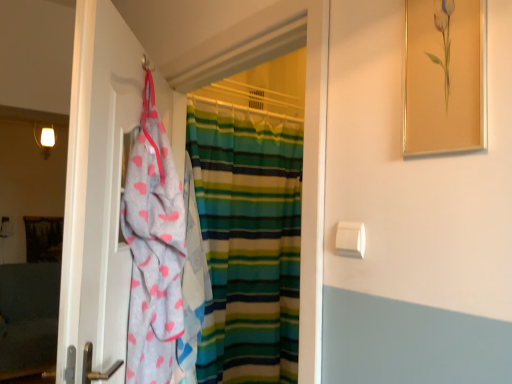
Find the location of a particular element. white plastic towel bar at center right is located at coordinates (350, 239).

What is the approximate height of white plastic towel bar at center right?

It is 3.22 inches.

What do you see at coordinates (97, 186) in the screenshot? This screenshot has height=384, width=512. I see `gray fabric towel at left` at bounding box center [97, 186].

In order to face striped fabric curtain at center, should I rotate leftwards or rightwards?

To face it directly, rotate left by 6.094 degrees.

The image size is (512, 384). What do you see at coordinates (248, 242) in the screenshot?
I see `striped fabric curtain at center` at bounding box center [248, 242].

Image resolution: width=512 pixels, height=384 pixels. I want to click on white plastic towel bar at center right, so click(350, 239).

Is gray fabric towel at left bigger or smaller than gold-framed painting at upper right?

gray fabric towel at left is bigger than gold-framed painting at upper right.

Is gray fabric towel at left inside or outside of gold-framed painting at upper right?

gray fabric towel at left is located beyond the bounds of gold-framed painting at upper right.

Find the location of a particular element. The height and width of the screenshot is (384, 512). picture frame that is above the gray fabric towel at left (from a real-world perspective) is located at coordinates (445, 76).

Do you think white plastic towel bar at center right is within gray fabric towel at left, or outside of it?

white plastic towel bar at center right lies outside gray fabric towel at left.

In the scene shown: Is white plastic towel bar at center right not near gray fabric towel at left?

No, white plastic towel bar at center right is in close proximity to gray fabric towel at left.

Considering the relative sizes of white plastic towel bar at center right and gray fabric towel at left in the image provided, is white plastic towel bar at center right wider than gray fabric towel at left?

In fact, white plastic towel bar at center right might be narrower than gray fabric towel at left.

How distant is white plastic towel bar at center right from gray fabric towel at left?

A distance of 26.20 inches exists between white plastic towel bar at center right and gray fabric towel at left.

In terms of width, does striped fabric curtain at center look wider or thinner when compared to gold-framed painting at upper right?

Considering their sizes, striped fabric curtain at center looks broader than gold-framed painting at upper right.

Can you confirm if striped fabric curtain at center is positioned to the right of gold-framed painting at upper right?

In fact, striped fabric curtain at center is to the left of gold-framed painting at upper right.

Which point is more distant from viewer, (253, 339) or (461, 28)?

The point (253, 339) is more distant.

Considering the sizes of objects striped fabric curtain at center and gold-framed painting at upper right in the image provided, who is bigger, striped fabric curtain at center or gold-framed painting at upper right?

striped fabric curtain at center.

Which object is closer to the camera, white plastic towel bar at center right or gold-framed painting at upper right?

Positioned in front is gold-framed painting at upper right.

Is white plastic towel bar at center right positioned with its back to gold-framed painting at upper right?

That's not correct — white plastic towel bar at center right is not looking away from gold-framed painting at upper right.

Does point (356, 234) lie in front of point (443, 25)?

That is False.

From a real-world perspective, is white plastic towel bar at center right located beneath gold-framed painting at upper right?

Yes.

Does gold-framed painting at upper right appear on the left side of gray fabric towel at left?

In fact, gold-framed painting at upper right is to the right of gray fabric towel at left.

From the image's perspective, is gold-framed painting at upper right located above or below gray fabric towel at left?

gold-framed painting at upper right is situated higher than gray fabric towel at left in the image.

Is gray fabric towel at left located within gold-framed painting at upper right?

No.

Relative to white plastic towel bar at center right, is striped fabric curtain at center in front or behind?

striped fabric curtain at center is positioned farther from the viewer than white plastic towel bar at center right.

How far apart are striped fabric curtain at center and white plastic towel bar at center right?

striped fabric curtain at center and white plastic towel bar at center right are 1.24 meters apart.

From the image's perspective, between striped fabric curtain at center and white plastic towel bar at center right, who is located below?

white plastic towel bar at center right.

Is striped fabric curtain at center taller or shorter than white plastic towel bar at center right?

Considering their sizes, striped fabric curtain at center has more height than white plastic towel bar at center right.

From a real-world perspective, is gold-framed painting at upper right located beneath striped fabric curtain at center?

Actually, gold-framed painting at upper right is physically above striped fabric curtain at center in the real world.

Considering the sizes of objects gold-framed painting at upper right and striped fabric curtain at center in the image provided, who is wider, gold-framed painting at upper right or striped fabric curtain at center?

With larger width is striped fabric curtain at center.

How far apart are gold-framed painting at upper right and striped fabric curtain at center?

They are 4.46 feet apart.

In the scene shown: Between gold-framed painting at upper right and striped fabric curtain at center, which one appears on the right side from the viewer's perspective?

Positioned to the right is gold-framed painting at upper right.

Where is `door on the left of gold-framed painting at upper right`? door on the left of gold-framed painting at upper right is located at coordinates (97, 186).

The width and height of the screenshot is (512, 384). Identify the location of door located in front of the white plastic towel bar at center right. (97, 186).

Looking at the image, which one is located closer to gold-framed painting at upper right, white plastic towel bar at center right or striped fabric curtain at center?

The object closer to gold-framed painting at upper right is white plastic towel bar at center right.

Consider the image. From the image, which object appears to be nearer to striped fabric curtain at center, gold-framed painting at upper right or white plastic towel bar at center right?

The object closer to striped fabric curtain at center is white plastic towel bar at center right.

From the image, which object appears to be farther from white plastic towel bar at center right, gray fabric towel at left or striped fabric curtain at center?

striped fabric curtain at center is further to white plastic towel bar at center right.

Looking at the image, which one is located closer to striped fabric curtain at center, white plastic towel bar at center right or gray fabric towel at left?

The object closer to striped fabric curtain at center is gray fabric towel at left.

Estimate the real-world distances between objects in this image. Which object is closer to gray fabric towel at left, gold-framed painting at upper right or striped fabric curtain at center?

Result: gold-framed painting at upper right is positioned closer to the anchor gray fabric towel at left.

Which object lies nearer to the anchor point gold-framed painting at upper right, striped fabric curtain at center or gray fabric towel at left?

The object closer to gold-framed painting at upper right is gray fabric towel at left.

In the scene shown: Estimate the real-world distances between objects in this image. Which object is further from white plastic towel bar at center right, gold-framed painting at upper right or striped fabric curtain at center?

striped fabric curtain at center lies further to white plastic towel bar at center right than the other object.

Looking at the image, which one is located closer to gray fabric towel at left, striped fabric curtain at center or white plastic towel bar at center right?

Based on the image, white plastic towel bar at center right appears to be nearer to gray fabric towel at left.

You are a GUI agent. You are given a task and a screenshot of the screen. Output one action in this format:
    pyautogui.click(x=<x>, y=<y>)
    Task: Click on the towel bar between striped fabric curtain at center and gold-framed painting at upper right
    This screenshot has width=512, height=384.
    Given the screenshot: What is the action you would take?
    pyautogui.click(x=350, y=239)

Identify the location of curtain between gray fabric towel at left and gold-framed painting at upper right from left to right. The image size is (512, 384). (248, 242).

Identify the location of curtain between gray fabric towel at left and white plastic towel bar at center right in the horizontal direction. (248, 242).

Find the location of a particular element. The image size is (512, 384). towel bar between gray fabric towel at left and gold-framed painting at upper right in the horizontal direction is located at coordinates (350, 239).